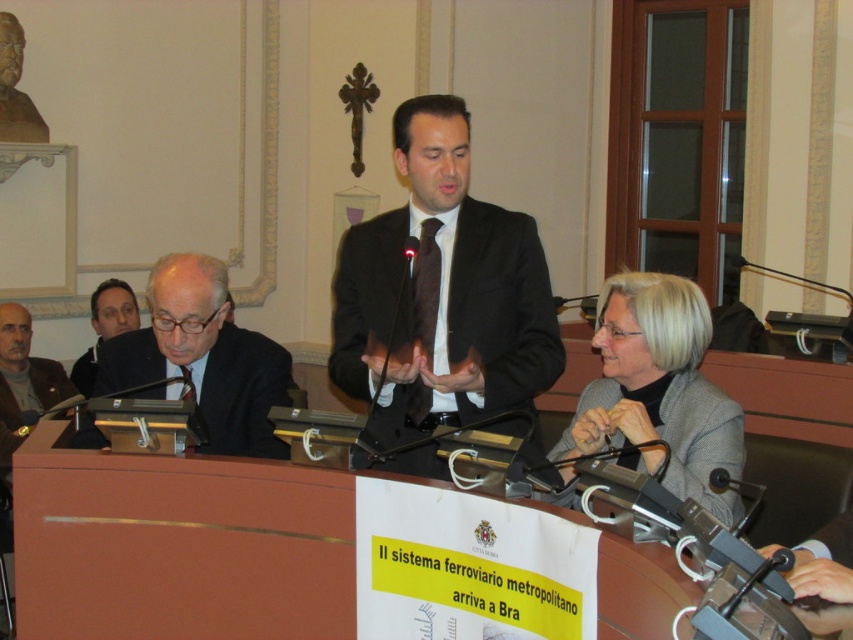
Is black suit at center taller than gray wool sweater at left?

Answer: Yes.

Does black suit at center have a greater width compared to gray wool sweater at left?

Indeed, black suit at center has a greater width compared to gray wool sweater at left.

The width and height of the screenshot is (853, 640). What do you see at coordinates (442, 294) in the screenshot?
I see `black suit at center` at bounding box center [442, 294].

Identify the location of black suit at center. The height and width of the screenshot is (640, 853). (442, 294).

Is black suit at center below black suit at left?

Incorrect, black suit at center is not positioned below black suit at left.

Locate an element on the screen. The height and width of the screenshot is (640, 853). black suit at center is located at coordinates click(x=442, y=294).

Which is above, wooden podium at center or gray wool sweater at left?

Positioned higher is gray wool sweater at left.

Is wooden podium at center above gray wool sweater at left?

Incorrect, wooden podium at center is not positioned above gray wool sweater at left.

Does point (161, 525) come farther from viewer compared to point (38, 392)?

No, (161, 525) is in front of (38, 392).

Identify the location of wooden podium at center. (178, 547).